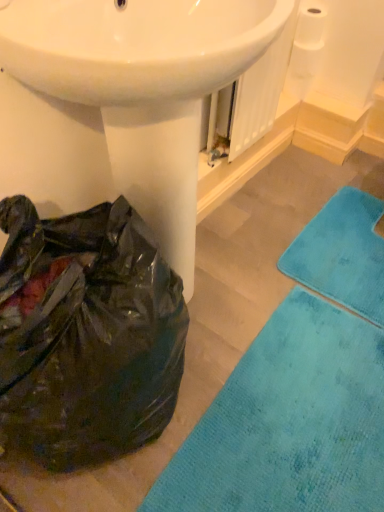
The image size is (384, 512). What are the coordinates of `blank space situated above teal plush bath towel at lower right (from a real-world perspective)` in the screenshot? It's located at (343, 241).